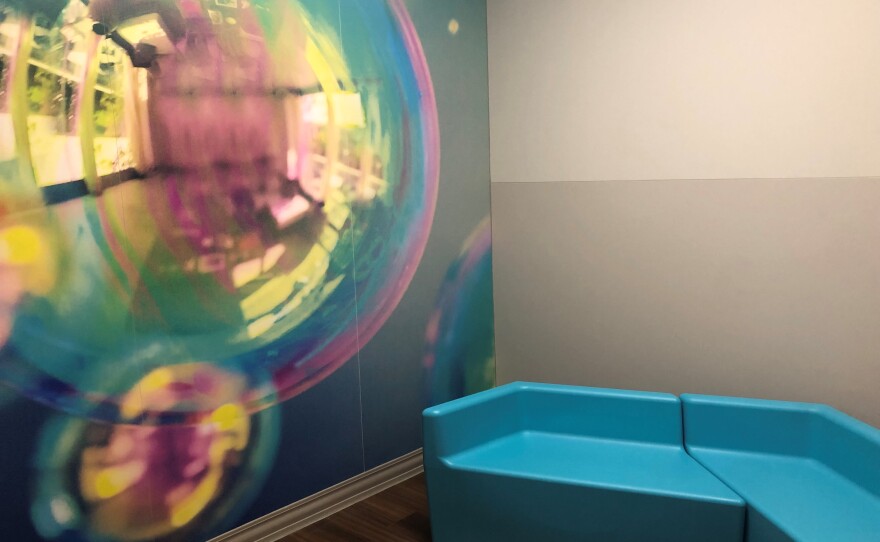
The height and width of the screenshot is (542, 880). In order to click on grey part of wall in this screenshot , I will do `click(682, 224)`.